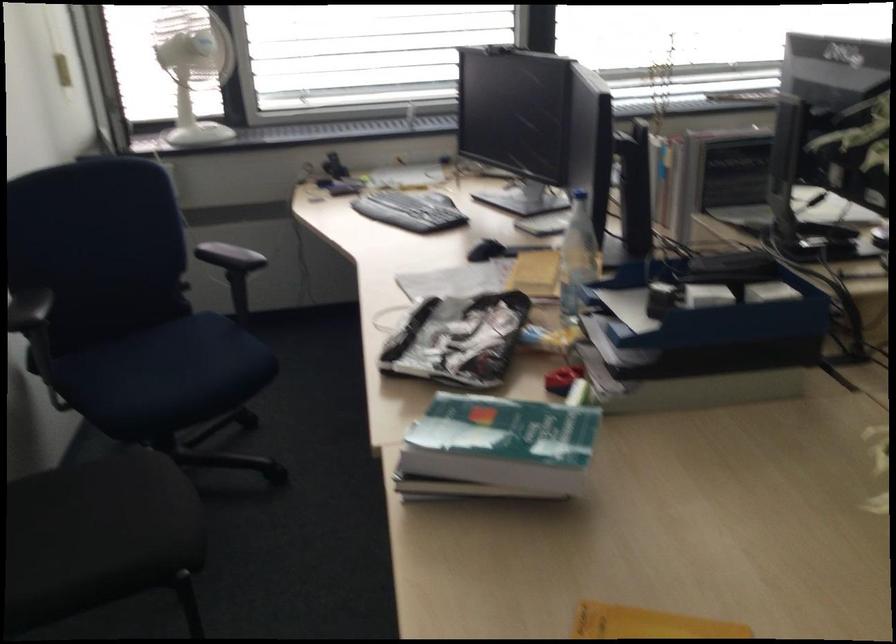
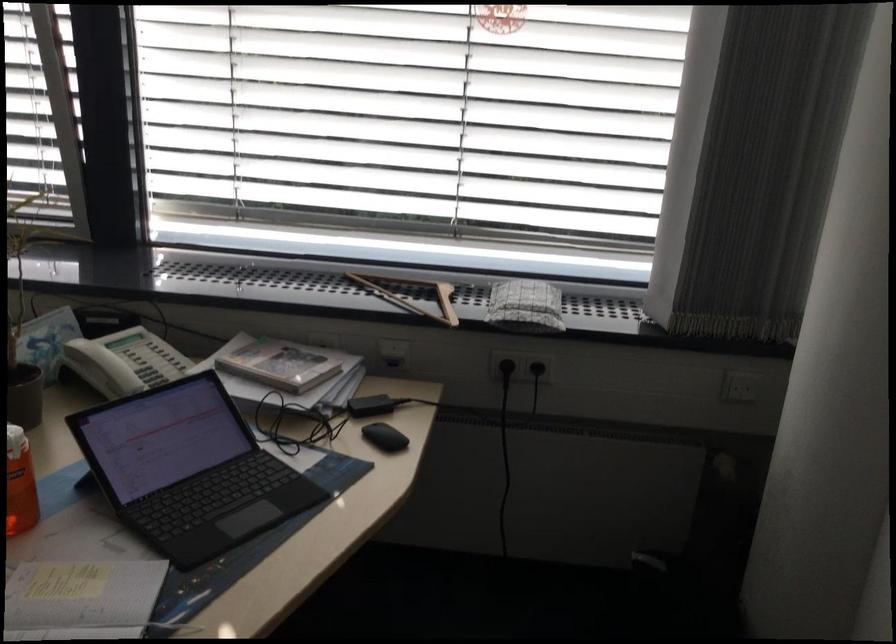
The images are taken continuously from a first-person perspective. In which direction are you moving?

The cameraman moved toward right, forward.